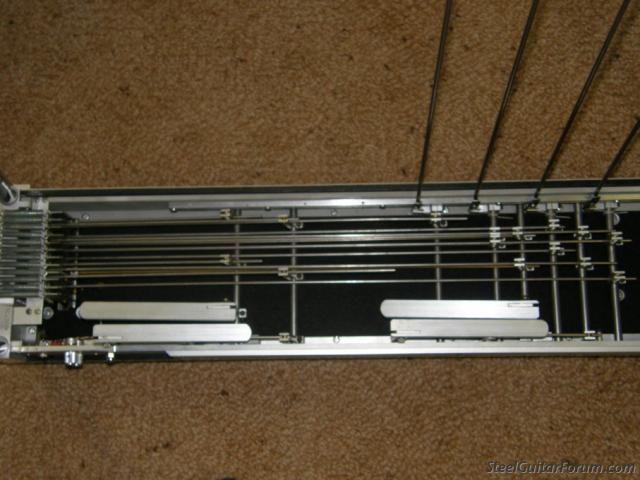
Image resolution: width=640 pixels, height=480 pixels. I want to click on black metal interior, so click(x=201, y=293), click(x=265, y=296), click(x=333, y=300), click(x=470, y=291), click(x=514, y=291), click(x=539, y=293), click(x=569, y=295), click(x=596, y=290), click(x=630, y=297).